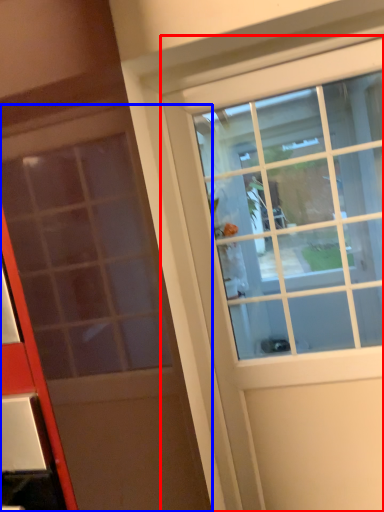
Question: Which of the following is the closest to the observer, door (highlighted by a red box) or door (highlighted by a blue box)?

Choices:
 (A) door
 (B) door

Answer: (B)